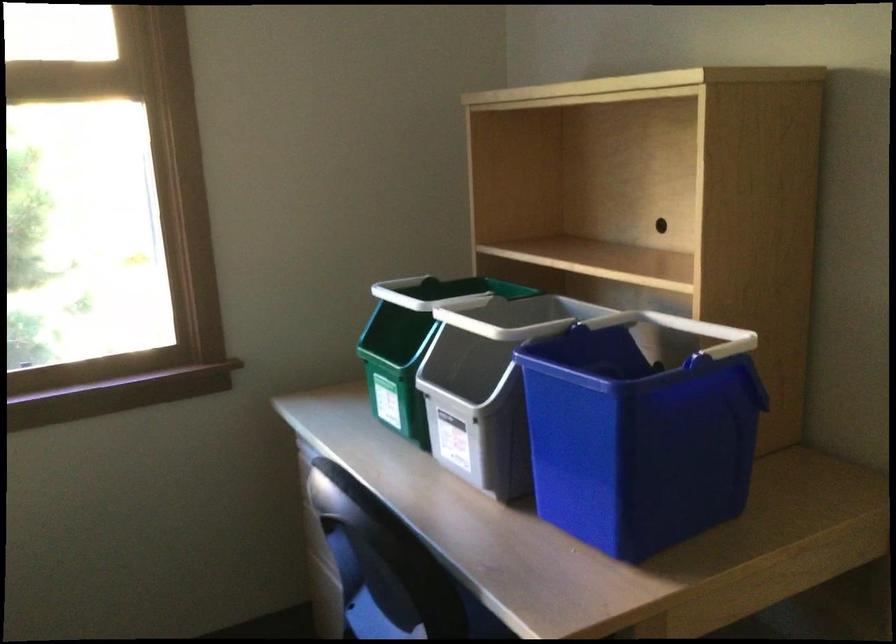
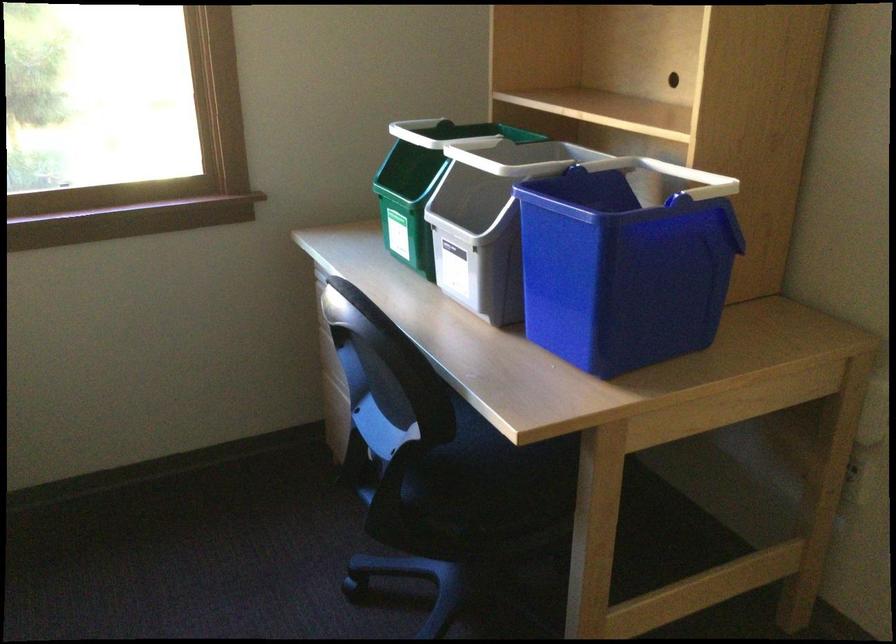
Where in the second image is the point corresponding to the point at 476,363 from the first image?

(479, 201)